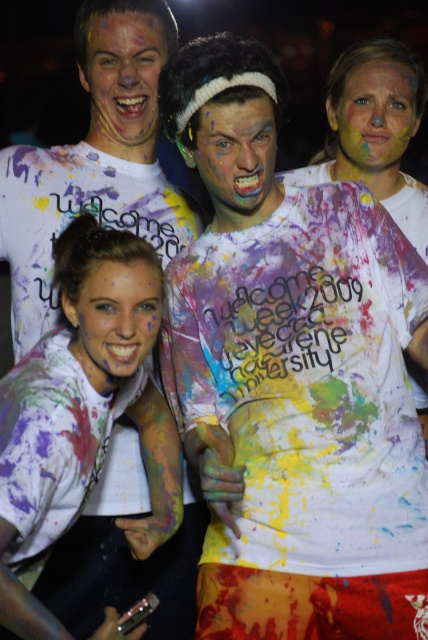
Question: Does painted skin face at upper left appear over matte white face at lower left?

Choices:
 (A) no
 (B) yes

Answer: (B)

Question: Is matte white shirt at center positioned behind painted skin face at upper right?

Choices:
 (A) yes
 (B) no

Answer: (B)

Question: Based on their relative distances, which object is nearer to the matte white shirt at center?

Choices:
 (A) painted skin face at upper left
 (B) painted skin face at center
 (C) matte white face at lower left

Answer: (C)

Question: Among these objects, which one is farthest from the camera?

Choices:
 (A) matte white face at lower left
 (B) matte white shirt at center
 (C) painted skin face at center

Answer: (C)

Question: Among these points, which one is farthest from the camera?

Choices:
 (A) (139, 28)
 (B) (44, 620)
 (C) (329, 113)
 (D) (121, 372)

Answer: (C)

Question: Does matte white face at lower left appear over painted skin face at upper right?

Choices:
 (A) no
 (B) yes

Answer: (A)